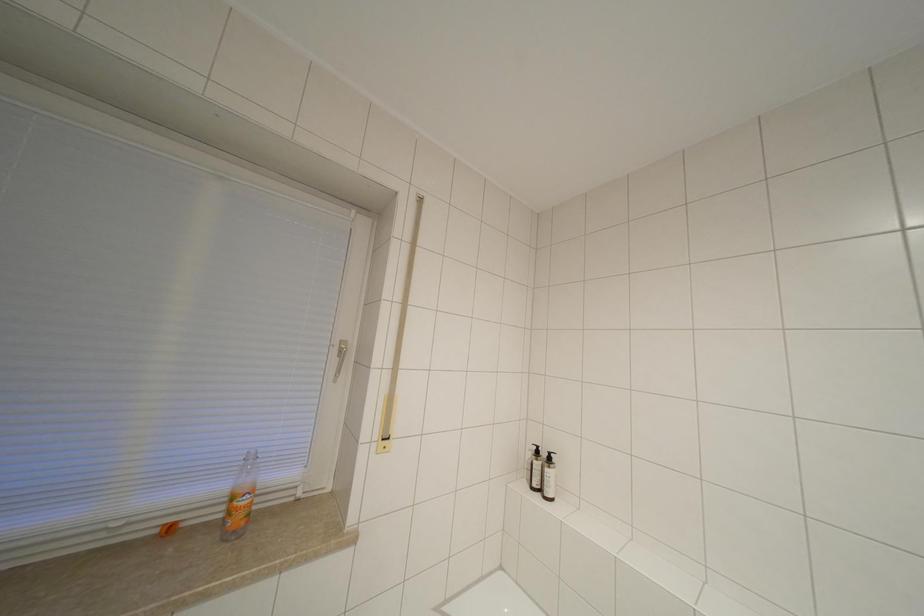
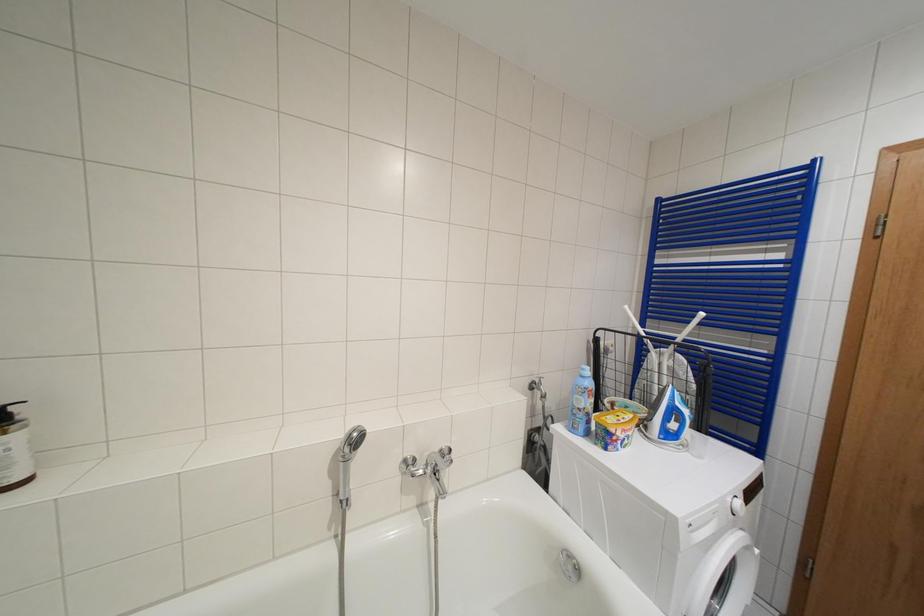
Question: The images are taken continuously from a first-person perspective. In which direction is your viewpoint rotating?

Choices:
 (A) Left
 (B) Right
 (C) Up
 (D) Down

Answer: (B)